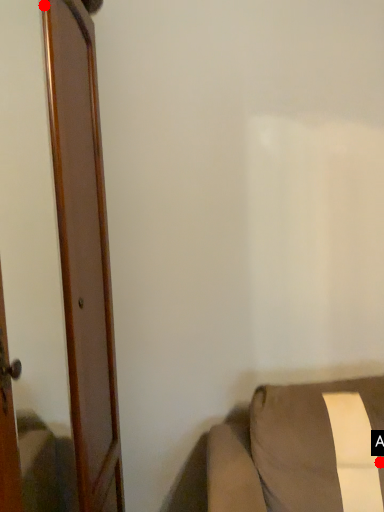
Question: Two points are circled on the image, labeled by A and B beside each circle. Among these points, which one is farthest from the camera?

Choices:
 (A) A is further
 (B) B is further

Answer: (A)